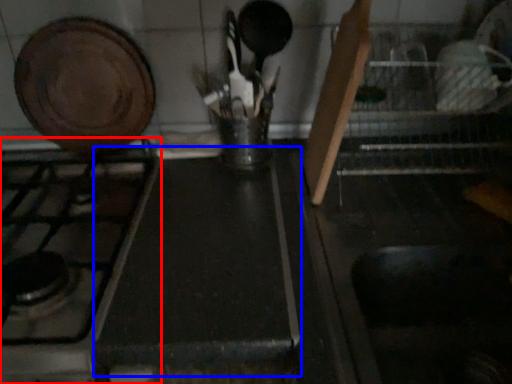
Question: Among these objects, which one is nearest to the camera, gas stove (highlighted by a red box) or counter top (highlighted by a blue box)?

Choices:
 (A) gas stove
 (B) counter top

Answer: (A)